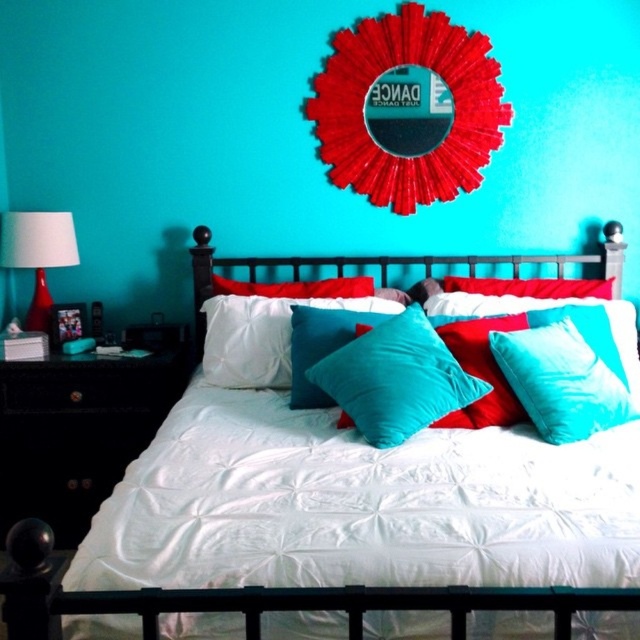
Based on the photo, you are moving a 3.5 feet wide painting and want to place it between the black glossy dresser at left and the teal soft cushion at center. Will the painting fit in the space between them?

The space between the black glossy dresser at left and the teal soft cushion at center is 3.40 feet. Since the painting is 3.5 feet wide, it will not fit in the space between them.

Looking at this image, you are organizing a small party in the bedroom and need to place a 1.2 meter long table. The table must be placed either on the spot where the black glossy dresser at left is currently located or where the teal soft cushion at center is. Based on their sizes, which location can accommodate the table?

The black glossy dresser at left is bigger than the teal soft cushion at center, so the table can be placed where the black glossy dresser at left is located since it has more space.